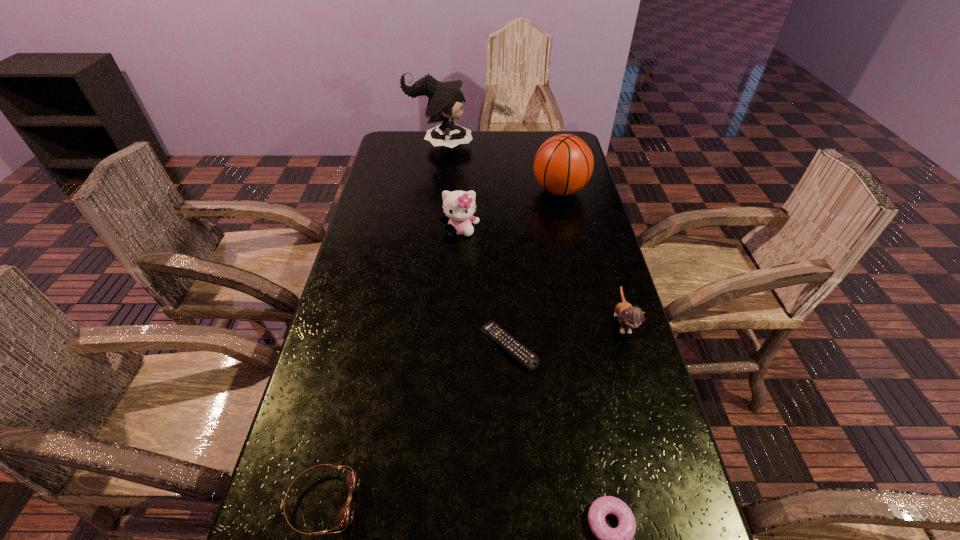
This screenshot has width=960, height=540. Identify the location of vacant point that satisfies the following two spatial constraints: 1. at the face of the farthest object; 2. on the left side of the second farthest object. (434, 191).